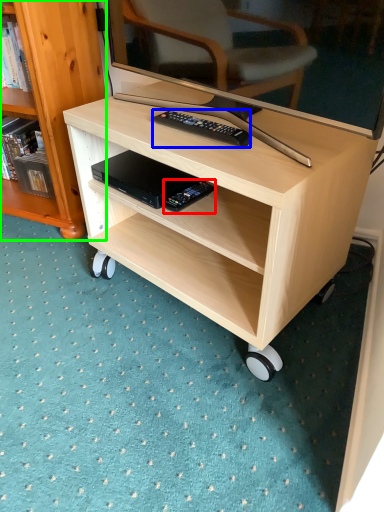
Question: Considering the real-world distances, which object is closest to equipment (highlighted by a red box)? remote control (highlighted by a blue box) or bookcase (highlighted by a green box).

Choices:
 (A) remote control
 (B) bookcase

Answer: (A)